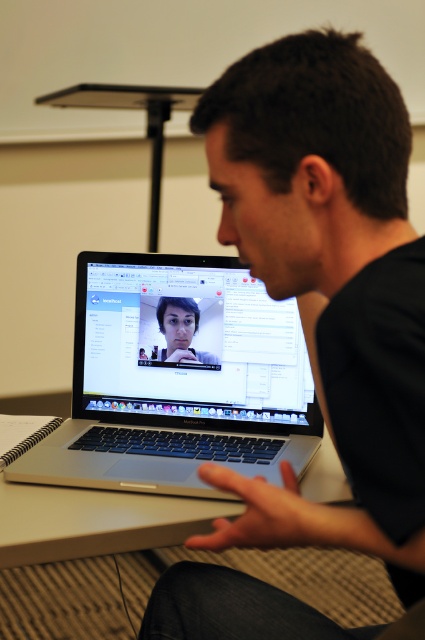
Consider the image. Does black matte laptop at center appear on the right side of silver metallic laptop at center?

Yes, black matte laptop at center is to the right of silver metallic laptop at center.

In order to click on black matte laptop at center in this screenshot , I will do `click(328, 284)`.

Does silver metallic laptop at center have a greater height compared to silver metallic table at center?

Correct, silver metallic laptop at center is much taller as silver metallic table at center.

Which is below, silver metallic laptop at center or silver metallic table at center?

silver metallic table at center is lower down.

Does point (147, 305) come in front of point (67, 518)?

No, it is behind (67, 518).

Find the location of a particular element. This screenshot has height=640, width=425. silver metallic laptop at center is located at coordinates (178, 378).

Where is `black matte laptop at center`? black matte laptop at center is located at coordinates (328, 284).

Is point (269, 586) positioned in front of point (190, 513)?

Yes, point (269, 586) is in front of point (190, 513).

Identify the location of black matte laptop at center. (328, 284).